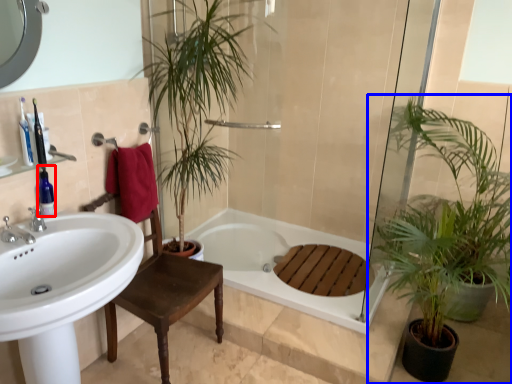
Question: Which of the following is the farthest to the observer, toiletry (highlighted by a red box) or houseplant (highlighted by a blue box)?

Choices:
 (A) toiletry
 (B) houseplant

Answer: (A)